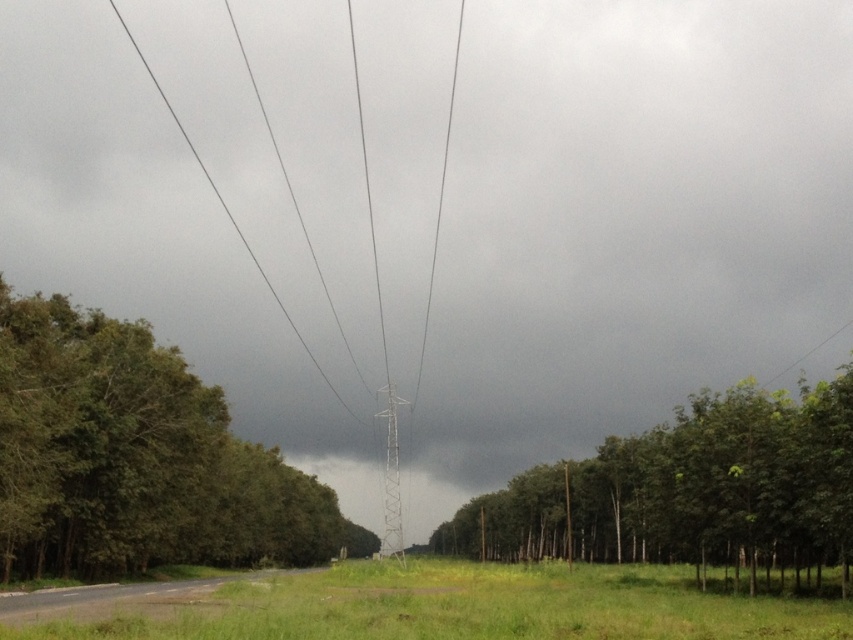
You are a bird seeking shelter from the storm. You see the green leafy tree at left and the green leafy trees at center. Which one would provide more coverage?

The green leafy trees at center are thicker than the green leafy tree at left, so they would provide more coverage for shelter.

You are a drone operator planning to fly a drone from point A to point B in this rural area. The coordinates for point A are point (158, 435) and point B are point (309, 593). Considering the transmission tower and power lines in the middle ground, which point is closer to you, the operator, so you can start your flight path there?

Point (158, 435) is closer to you than point (309, 593), so you should start your flight path from point (158, 435).